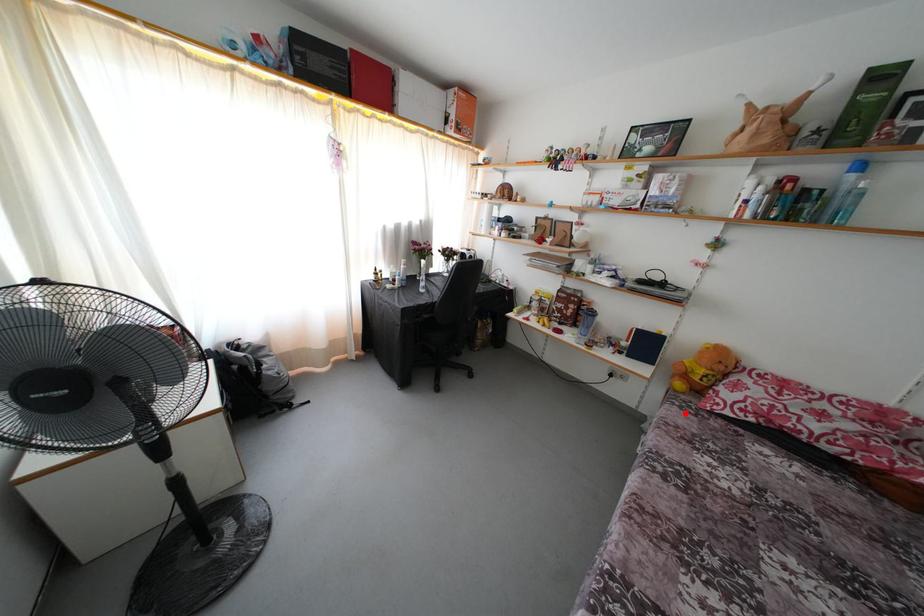
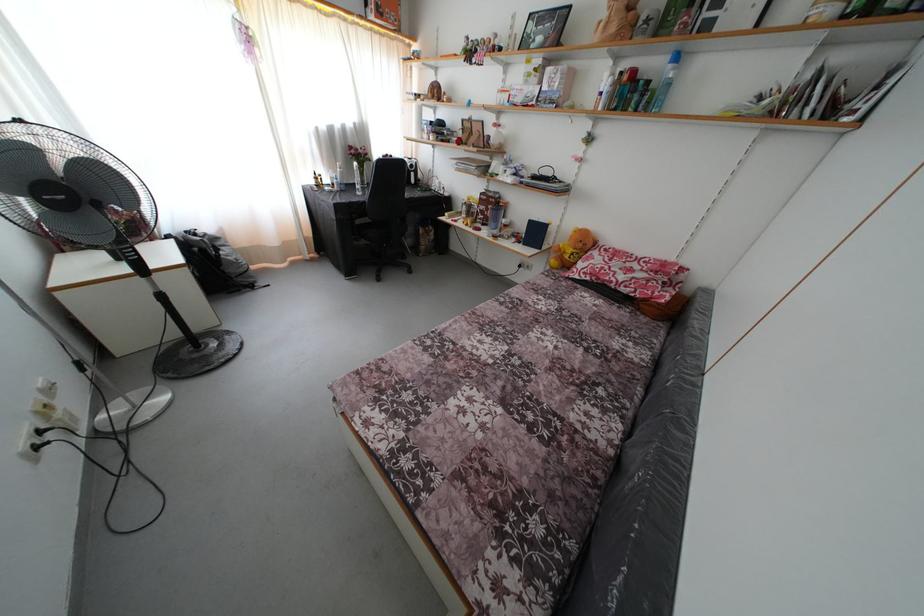
Find the pixel in the second image that matches the highlighted location in the first image.

(552, 282)